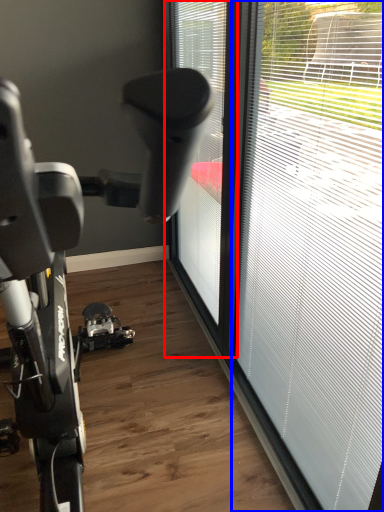
Question: Which object is closer to the camera taking this photo, window (highlighted by a red box) or window (highlighted by a blue box)?

Choices:
 (A) window
 (B) window

Answer: (B)